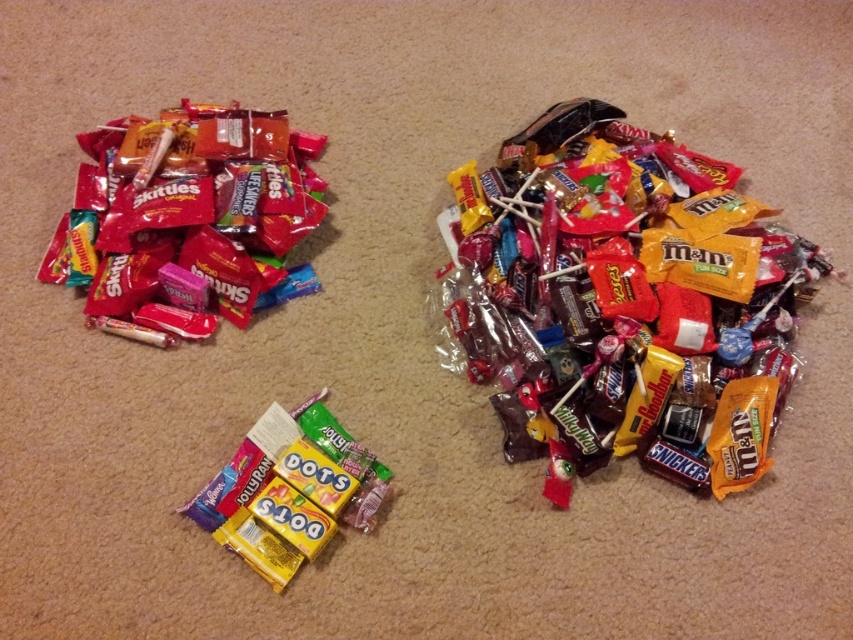
You are a child trying to reach both the Skittles and the MMs from the point marked at coordinate (660,380). Which candy is closer to you?

The distance between the point and the Skittles is 0.7 meters, and the distance between the point and the MMs is 0.66 meters. Therefore, the MMs are closer to the point marked at coordinate (660,380).

You are a child trying to grab candies from the floor. You see two points on the floor where candies are piled up. The first point is at coordinates point [268,280] and the second is at point [259,512]. Which point is closer to you?

The point [268,280] is closer to you because it is further to the camera than point [259,512], meaning it is nearer in your line of sight.

You are organizing a candy display and need to place the shiny chocolate bar at center and the yellow matte dots at center on a shelf. Which object should you place first if you want to ensure both fit without overlapping?

You should place the shiny chocolate bar at center first since it is larger than the yellow matte dots at center, ensuring there is enough space for both on the shelf.